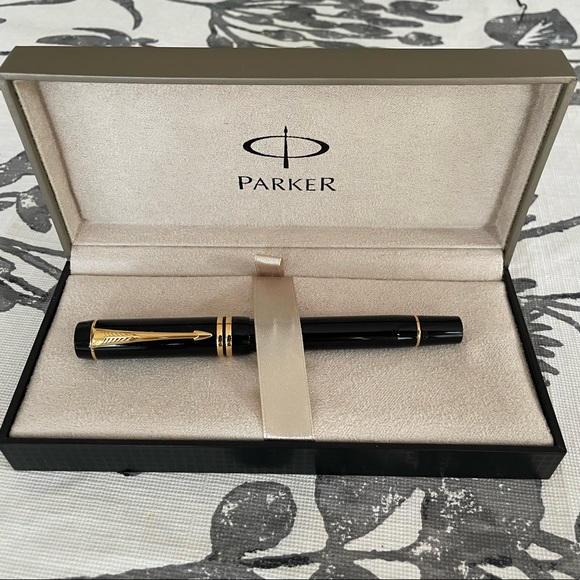
Where is `table cloth`? table cloth is located at coordinates (569, 269).